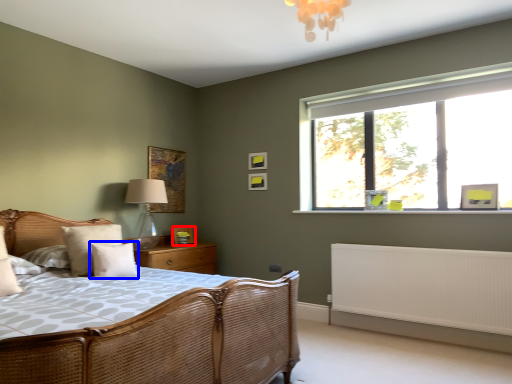
Question: Which of the following is the closest to the observer, picture frame (highlighted by a red box) or pillow (highlighted by a blue box)?

Choices:
 (A) picture frame
 (B) pillow

Answer: (B)